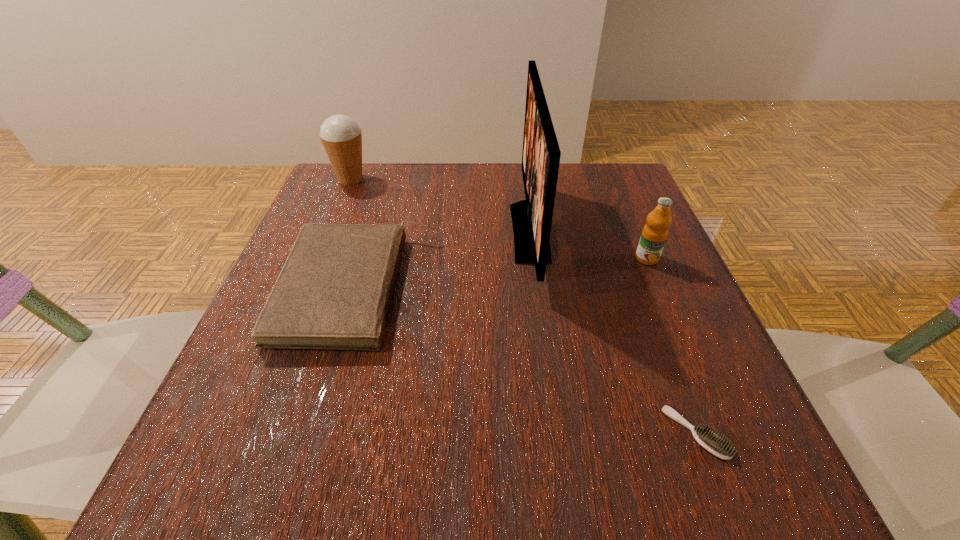
The width and height of the screenshot is (960, 540). Find the location of `scrubbing brush present at the right edge`. scrubbing brush present at the right edge is located at coordinates [x=716, y=445].

Where is `object situated at the far left corner`? object situated at the far left corner is located at coordinates (341, 136).

Find the location of a particular element. The height and width of the screenshot is (540, 960). object at the near right corner is located at coordinates (716, 445).

Identify the location of vacant position at the near edge of the desktop. (443, 500).

At what (x,y) coordinates should I click in order to perform the action: click on vacant space at the left edge of the desktop. Please return your answer as a coordinate pair (x, y). The image size is (960, 540). Looking at the image, I should click on (237, 408).

Where is `free space at the right edge`? free space at the right edge is located at coordinates (595, 227).

In the image, there is a desktop. Where is `vacant space at the far left corner`? Image resolution: width=960 pixels, height=540 pixels. vacant space at the far left corner is located at coordinates (368, 212).

This screenshot has width=960, height=540. In the image, there is a desktop. What are the coordinates of `vacant space at the near left corner` in the screenshot? It's located at (232, 483).

Image resolution: width=960 pixels, height=540 pixels. I want to click on free space at the far right corner, so click(x=626, y=198).

I want to click on empty space that is in between the icecream and the monitor, so click(441, 206).